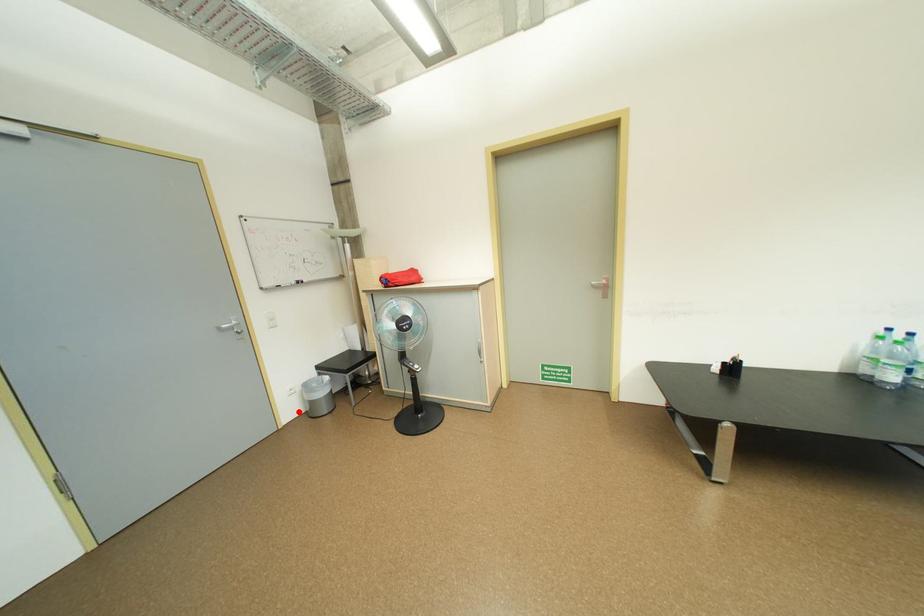
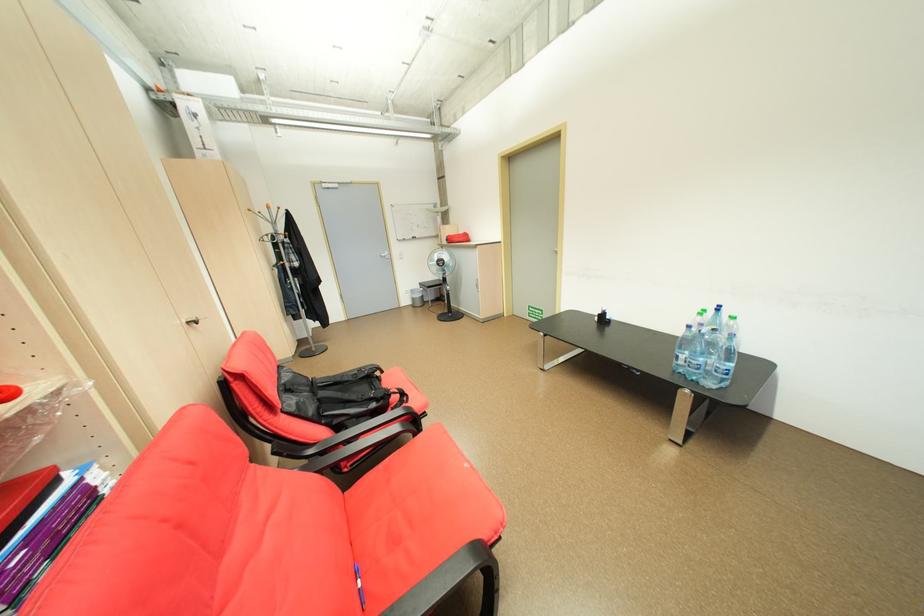
Question: I am providing you with two images of the same scene from different viewpoints. Image1 has a red point marked. In image2, the corresponding 3D location appears at what relative position? Reply with the corresponding letter.

Choices:
 (A) Closer
 (B) Farther

Answer: (A)